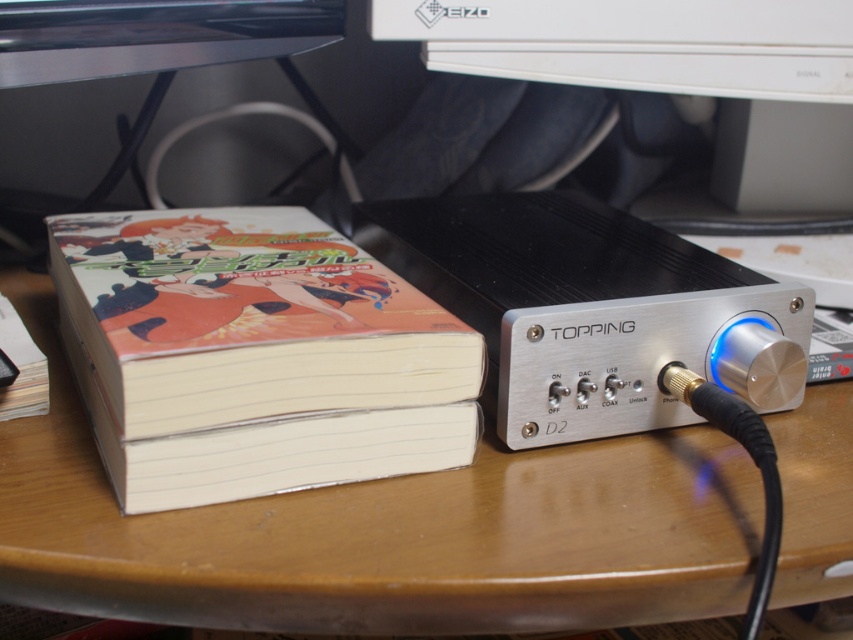
I want to click on wooden at center, so click(x=381, y=532).

Is point (190, 595) positioned before point (495, 56)?

Yes, point (190, 595) is closer to viewer.

Find the location of `wooden at center`. wooden at center is located at coordinates (381, 532).

Between matte paperback book at left and white plastic monitor at upper center, which one is positioned higher?

white plastic monitor at upper center

Does matte paperback book at left have a greater height compared to white plastic monitor at upper center?

Yes, matte paperback book at left is taller than white plastic monitor at upper center.

What do you see at coordinates (254, 355) in the screenshot? I see `matte paperback book at left` at bounding box center [254, 355].

At what (x,y) coordinates should I click in order to perform the action: click on matte paperback book at left. Please return your answer as a coordinate pair (x, y). The height and width of the screenshot is (640, 853). Looking at the image, I should click on (254, 355).

Is point (689, 561) positioned in front of point (123, 292)?

Yes, point (689, 561) is in front of point (123, 292).

Who is shorter, wooden at center or matte paperback book at left?

wooden at center

This screenshot has height=640, width=853. What do you see at coordinates (381, 532) in the screenshot? I see `wooden at center` at bounding box center [381, 532].

Find the location of `wooden at center`. wooden at center is located at coordinates (381, 532).